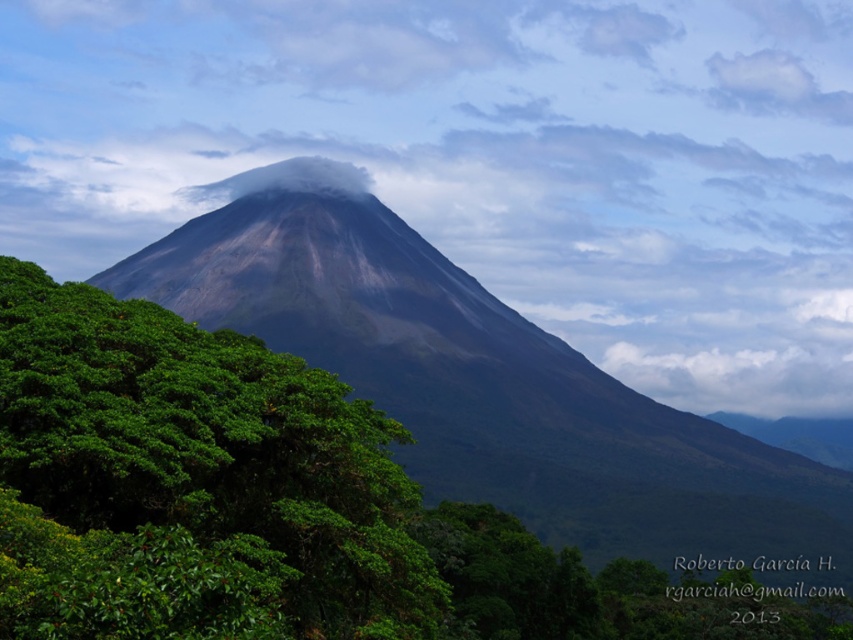
You are a photographer planning to capture the volcanic rock mountain at center and the white fluffy cloud at upper center in a single frame. Based on their sizes, which one should you focus on to ensure both fit in the shot?

The white fluffy cloud at upper center is wider than the volcanic rock mountain at center, so focusing on the cloud first would help ensure both fit in the frame.